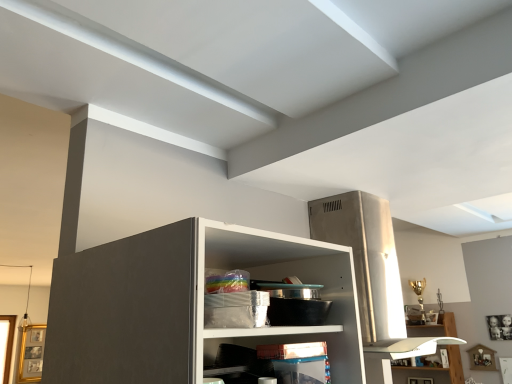
What do you see at coordinates (417, 353) in the screenshot?
I see `white glossy shelf at lower right, placed as the 1th shelf when sorted from right to left` at bounding box center [417, 353].

Image resolution: width=512 pixels, height=384 pixels. Find the location of `white glossy shelf at lower right, the 1th shelf ordered from the bottom`. white glossy shelf at lower right, the 1th shelf ordered from the bottom is located at coordinates (417, 353).

The width and height of the screenshot is (512, 384). Describe the element at coordinates (298, 341) in the screenshot. I see `translucent plastic container at lower center, the second shelf in the back-to-front sequence` at that location.

The height and width of the screenshot is (384, 512). Find the location of `translucent plastic container at lower center, the second shelf in the back-to-front sequence`. translucent plastic container at lower center, the second shelf in the back-to-front sequence is located at coordinates (298, 341).

At what (x,y) coordinates should I click in order to perform the action: click on white glossy shelf at lower right, which is the second shelf in front-to-back order. Please return your answer as a coordinate pair (x, y). Image resolution: width=512 pixels, height=384 pixels. Looking at the image, I should click on (417, 353).

Considering the positions of objects translucent plastic container at lower center, the second shelf in the back-to-front sequence, and white glossy shelf at lower right, arranged as the 2th shelf when viewed from the left, in the image provided, who is more to the right, translucent plastic container at lower center, the second shelf in the back-to-front sequence, or white glossy shelf at lower right, arranged as the 2th shelf when viewed from the left,?

From the viewer's perspective, white glossy shelf at lower right, arranged as the 2th shelf when viewed from the left, appears more on the right side.

Does translucent plastic container at lower center, which is the second shelf from right to left, come behind white glossy shelf at lower right, placed as the 2th shelf when sorted from top to bottom?

No, it is not.

Does point (338, 362) appear closer or farther from the camera than point (401, 340)?

Point (338, 362) is positioned closer to the camera compared to point (401, 340).

From the image's perspective, between translucent plastic container at lower center, which is the second shelf from right to left, and white glossy shelf at lower right, positioned as the 1th shelf in back-to-front order, which one is located above?

translucent plastic container at lower center, which is the second shelf from right to left, is shown above in the image.

From a real-world perspective, is translucent plastic container at lower center, which is counted as the 1th shelf, starting from the left, under white glossy shelf at lower right, which is the second shelf in front-to-back order?

No, from a real-world perspective, translucent plastic container at lower center, which is counted as the 1th shelf, starting from the left, is not below white glossy shelf at lower right, which is the second shelf in front-to-back order.

Considering the sizes of objects translucent plastic container at lower center, which appears as the 2th shelf when ordered from the bottom, and white glossy shelf at lower right, placed as the 1th shelf when sorted from right to left, in the image provided, who is thinner, translucent plastic container at lower center, which appears as the 2th shelf when ordered from the bottom, or white glossy shelf at lower right, placed as the 1th shelf when sorted from right to left,?

white glossy shelf at lower right, placed as the 1th shelf when sorted from right to left, is thinner.

Considering the sizes of objects translucent plastic container at lower center, which appears as the 2th shelf when ordered from the bottom, and white glossy shelf at lower right, placed as the 2th shelf when sorted from top to bottom, in the image provided, who is taller, translucent plastic container at lower center, which appears as the 2th shelf when ordered from the bottom, or white glossy shelf at lower right, placed as the 2th shelf when sorted from top to bottom,?

white glossy shelf at lower right, placed as the 2th shelf when sorted from top to bottom.

Who is bigger, translucent plastic container at lower center, which is the second shelf from right to left, or white glossy shelf at lower right, positioned as the 1th shelf in back-to-front order?

white glossy shelf at lower right, positioned as the 1th shelf in back-to-front order.

Is translucent plastic container at lower center, which appears as the 2th shelf when ordered from the bottom, not inside white glossy shelf at lower right, the 1th shelf ordered from the bottom?

translucent plastic container at lower center, which appears as the 2th shelf when ordered from the bottom, lies outside white glossy shelf at lower right, the 1th shelf ordered from the bottom,'s area.

Looking at this image, is there a large distance between translucent plastic container at lower center, the first shelf in the front-to-back sequence, and white glossy shelf at lower right, arranged as the 2th shelf when viewed from the left?

Absolutely, translucent plastic container at lower center, the first shelf in the front-to-back sequence, is distant from white glossy shelf at lower right, arranged as the 2th shelf when viewed from the left.

Does translucent plastic container at lower center, the second shelf in the back-to-front sequence, turn towards white glossy shelf at lower right, arranged as the 2th shelf when viewed from the left?

No, translucent plastic container at lower center, the second shelf in the back-to-front sequence, is not facing towards white glossy shelf at lower right, arranged as the 2th shelf when viewed from the left.

What's the angular difference between translucent plastic container at lower center, which is counted as the 1th shelf, starting from the left, and white glossy shelf at lower right, positioned as the 1th shelf in back-to-front order,'s facing directions?

There is a 90.4-degree angle between the facing directions of translucent plastic container at lower center, which is counted as the 1th shelf, starting from the left, and white glossy shelf at lower right, positioned as the 1th shelf in back-to-front order.

How much distance is there between translucent plastic container at lower center, the second shelf in the back-to-front sequence, and white glossy shelf at lower right, which is the second shelf in front-to-back order?

A distance of 9.06 feet exists between translucent plastic container at lower center, the second shelf in the back-to-front sequence, and white glossy shelf at lower right, which is the second shelf in front-to-back order.

This screenshot has width=512, height=384. Identify the location of shelf that is above the white glossy shelf at lower right, placed as the 2th shelf when sorted from top to bottom (from a real-world perspective). (298, 341).

Considering the positions of objects white glossy shelf at lower right, placed as the 1th shelf when sorted from right to left, and translucent plastic container at lower center, which is the second shelf from right to left, in the image provided, who is more to the right, white glossy shelf at lower right, placed as the 1th shelf when sorted from right to left, or translucent plastic container at lower center, which is the second shelf from right to left,?

white glossy shelf at lower right, placed as the 1th shelf when sorted from right to left.

Which is behind, white glossy shelf at lower right, which is the second shelf in front-to-back order, or translucent plastic container at lower center, the first shelf in the front-to-back sequence?

white glossy shelf at lower right, which is the second shelf in front-to-back order, is further from the camera.

Is point (380, 364) farther from camera compared to point (213, 338)?

Yes.

From the image's perspective, which one is positioned higher, white glossy shelf at lower right, positioned as the 1th shelf in back-to-front order, or translucent plastic container at lower center, which appears as the 2th shelf when ordered from the bottom?

translucent plastic container at lower center, which appears as the 2th shelf when ordered from the bottom.

From a real-world perspective, is white glossy shelf at lower right, arranged as the 2th shelf when viewed from the left, on top of translucent plastic container at lower center, which appears as the 2th shelf when ordered from the bottom?

No, from a real-world perspective, white glossy shelf at lower right, arranged as the 2th shelf when viewed from the left, is not over translucent plastic container at lower center, which appears as the 2th shelf when ordered from the bottom

Is white glossy shelf at lower right, placed as the 1th shelf when sorted from right to left, wider than translucent plastic container at lower center, which appears as the 2th shelf when ordered from the bottom?

No, white glossy shelf at lower right, placed as the 1th shelf when sorted from right to left, is not wider than translucent plastic container at lower center, which appears as the 2th shelf when ordered from the bottom.

Does white glossy shelf at lower right, arranged as the 2th shelf when viewed from the left, have a greater height compared to translucent plastic container at lower center, which is counted as the 1th shelf, starting from the left?

Correct, white glossy shelf at lower right, arranged as the 2th shelf when viewed from the left, is much taller as translucent plastic container at lower center, which is counted as the 1th shelf, starting from the left.

Is white glossy shelf at lower right, placed as the 1th shelf when sorted from right to left, bigger than translucent plastic container at lower center, the second shelf in the back-to-front sequence?

Indeed, white glossy shelf at lower right, placed as the 1th shelf when sorted from right to left, has a larger size compared to translucent plastic container at lower center, the second shelf in the back-to-front sequence.

From the picture: Is white glossy shelf at lower right, positioned as the 1th shelf in back-to-front order, spatially inside translucent plastic container at lower center, the first shelf in the front-to-back sequence, or outside of it?

white glossy shelf at lower right, positioned as the 1th shelf in back-to-front order, is located beyond the bounds of translucent plastic container at lower center, the first shelf in the front-to-back sequence.

Is the surface of white glossy shelf at lower right, placed as the 2th shelf when sorted from top to bottom, in direct contact with translucent plastic container at lower center, which appears as the 2th shelf when ordered from the bottom?

They are not placed beside each other.

Is white glossy shelf at lower right, the 1th shelf ordered from the bottom, oriented towards translucent plastic container at lower center, the second shelf in the back-to-front sequence?

Yes, white glossy shelf at lower right, the 1th shelf ordered from the bottom, faces towards translucent plastic container at lower center, the second shelf in the back-to-front sequence.

Could you measure the distance between white glossy shelf at lower right, arranged as the 2th shelf when viewed from the left, and translucent plastic container at lower center, which is counted as the 1th shelf, starting from the left?

A distance of 2.76 meters exists between white glossy shelf at lower right, arranged as the 2th shelf when viewed from the left, and translucent plastic container at lower center, which is counted as the 1th shelf, starting from the left.

Where is `shelf to the right of translucent plastic container at lower center, which is counted as the 1th shelf, starting from the left`? shelf to the right of translucent plastic container at lower center, which is counted as the 1th shelf, starting from the left is located at coordinates (417, 353).

Locate an element on the screen. The image size is (512, 384). shelf below the translucent plastic container at lower center, the second shelf in the back-to-front sequence (from a real-world perspective) is located at coordinates (417, 353).

Locate an element on the screen. The image size is (512, 384). shelf that is behind the translucent plastic container at lower center, which appears as the 2th shelf when ordered from the bottom is located at coordinates (417, 353).